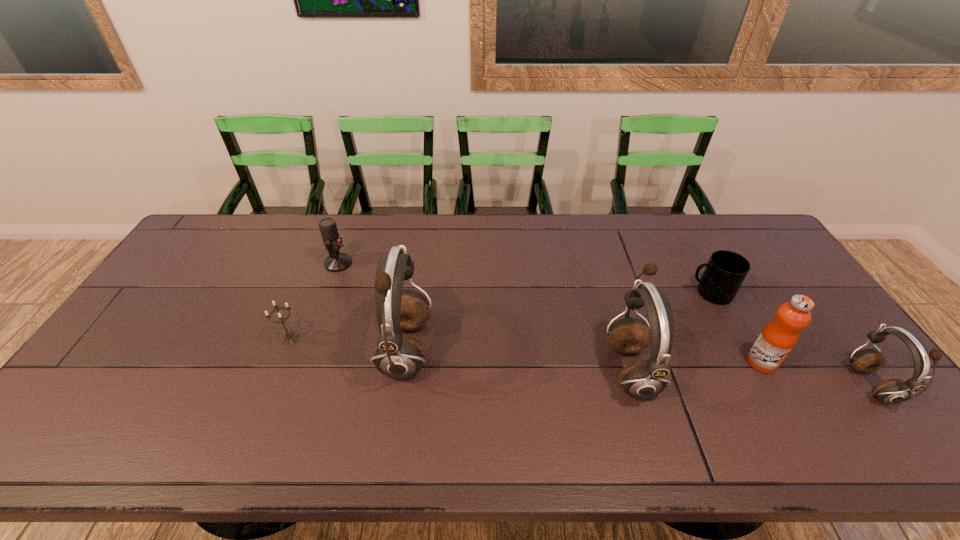
The width and height of the screenshot is (960, 540). Identify the location of unoccupied area between the candle holder and the sixth shortest object. pyautogui.click(x=460, y=354).

Find the location of a particular element. free point between the second earphone from right to left and the fifth tallest object is located at coordinates 484,315.

At what (x,y) coordinates should I click in order to perform the action: click on vacant space in between the fourth shortest object and the microphone. Please return your answer as a coordinate pair (x, y). The height and width of the screenshot is (540, 960). Looking at the image, I should click on (605, 325).

I want to click on free area in between the farthest object and the shortest earphone, so click(605, 325).

Identify the location of vacant area between the candle holder and the fourth shortest object. (581, 363).

This screenshot has width=960, height=540. In order to click on free space between the leftmost earphone and the mug in this screenshot , I will do `click(558, 322)`.

Locate an element on the screen. the third closest object to the mug is located at coordinates (889, 391).

In order to click on object that is the sixth closest to the leftmost earphone in this screenshot , I will do `click(889, 391)`.

Where is `earphone identified as the closest to the fourth object from left to right`? This screenshot has width=960, height=540. earphone identified as the closest to the fourth object from left to right is located at coordinates (399, 356).

Locate which earphone is the closest to the rightmost earphone. Please provide its 2D coordinates. Your answer should be formatted as a tuple, i.e. [(x, y)], where the tuple contains the x and y coordinates of a point satisfying the conditions above.

[(642, 379)]